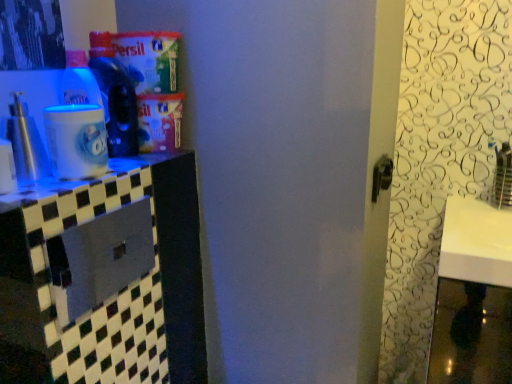
Question: Considering the positions of translucent plastic bottle at upper left, which is the 2th bottle in front-to-back order, and metallic silver spray at left, the 1th bottle when ordered from left to right, in the image, is translucent plastic bottle at upper left, which is the 2th bottle in front-to-back order, taller or shorter than metallic silver spray at left, the 1th bottle when ordered from left to right,?

Choices:
 (A) tall
 (B) short

Answer: (A)

Question: Is translucent plastic bottle at upper left, which is the 2th bottle in front-to-back order, bigger or smaller than metallic silver spray at left, marked as the second bottle in a right-to-left arrangement?

Choices:
 (A) big
 (B) small

Answer: (A)

Question: Which is farther from the metallic silver spray at left, the 1th bottle when ordered from left to right?

Choices:
 (A) metallic gray drawer at left
 (B) white glossy counter top at left
 (C) translucent plastic bottle at upper left, which is the 2th bottle in front-to-back order

Answer: (A)

Question: Which is farther from the metallic silver spray at left, marked as the second bottle in a right-to-left arrangement?

Choices:
 (A) metallic gray drawer at left
 (B) translucent plastic bottle at upper left, the 1th bottle viewed from the back
 (C) white glossy counter top at left

Answer: (A)